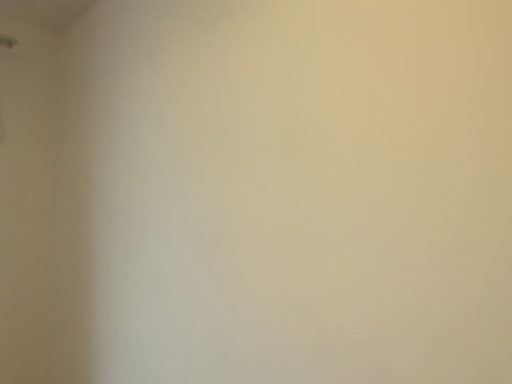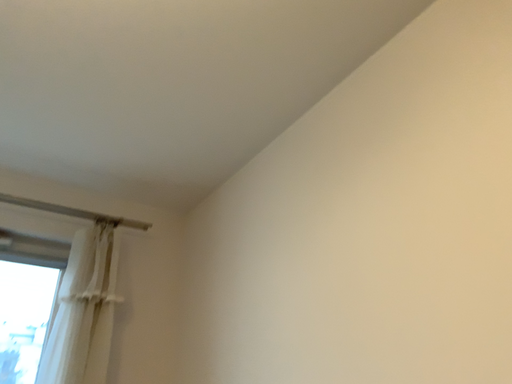
Question: Which way did the camera rotate in the video?

Choices:
 (A) rotated left
 (B) rotated right

Answer: (A)